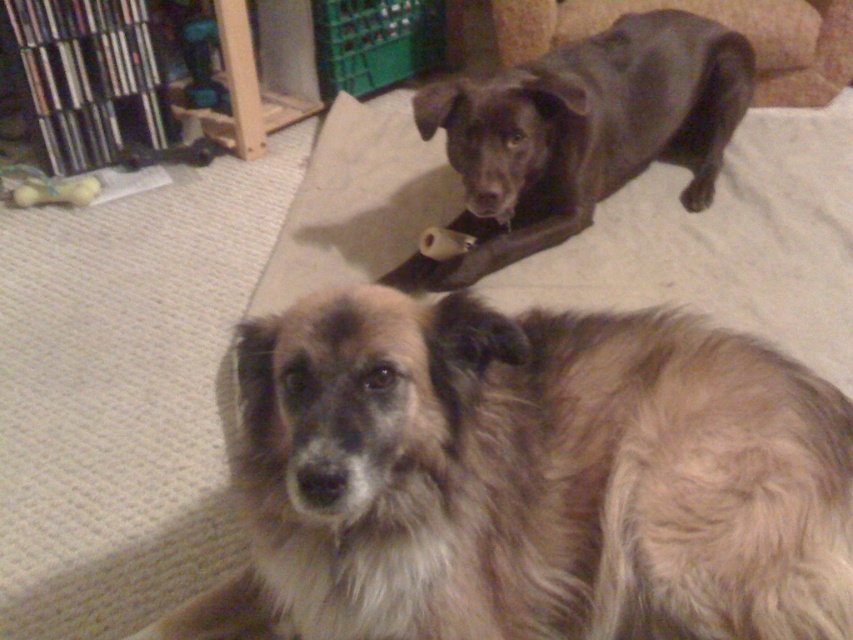
From the picture: You are a photographer trying to capture both dogs in a single shot. Since the brown shaggy dog at lower center is closer to the viewer than the shiny black dog at upper center, which dog should you focus on first to ensure both are in focus?

You should focus on the shiny black dog at upper center first because it is farther away. By focusing on the farther subject in a single shot, the closer subject will also be in focus due to the depth of field.

You are standing in the living room and want to walk from the entrance to the window on the far wall. There is a brown shaggy dog at lower center and a shiny black dog at upper center in your path. Which dog do you need to step around first?

You need to step around the brown shaggy dog at lower center first because it is positioned to the left of the shiny black dog at upper center, meaning it is closer to your starting point near the entrance.